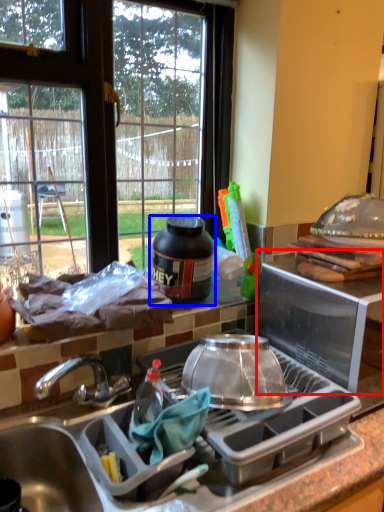
Question: Among these objects, which one is farthest to the camera, appliance (highlighted by a red box) or kitchen appliance (highlighted by a blue box)?

Choices:
 (A) appliance
 (B) kitchen appliance

Answer: (B)